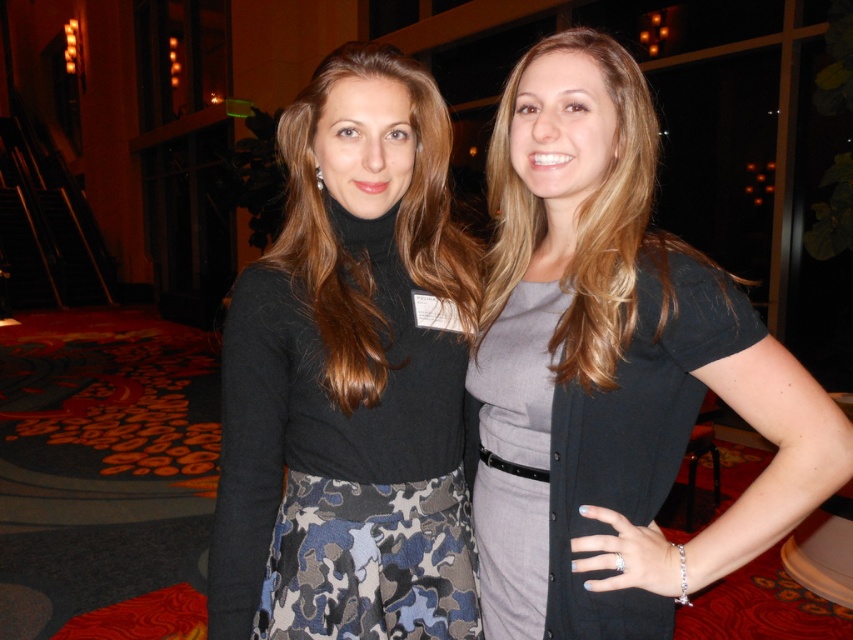
You are a photographer setting up for an event. You see two women wearing the gray matte dress at center and the matte gray dress at center. Which dress is positioned lower on the woman?

The gray matte dress at center is positioned lower than the matte gray dress at center.

You are organizing a photoshoot and need to place two dresses in the center of the frame. The gray matte dress at center and the matte gray dress at center must be positioned side by side. Which dress should be placed on the left to ensure there is enough space between them?

The gray matte dress at center has a lesser width compared to the matte gray dress at center, so placing it on the left would allow more space between the two dresses since it takes up less horizontal space.